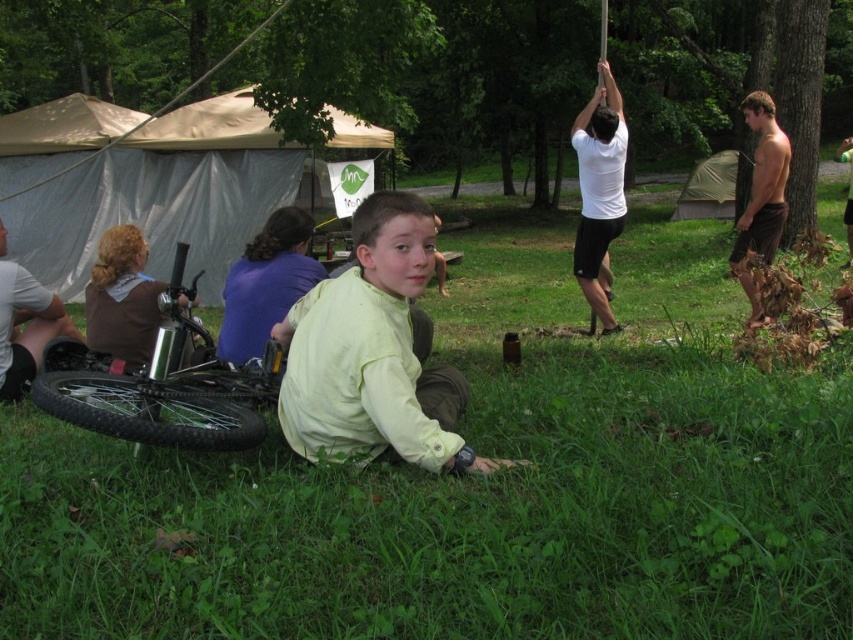
Question: Does green grass at lower center lie in front of silver metallic bicycle at lower left?

Choices:
 (A) no
 (B) yes

Answer: (B)

Question: Which of the following is the closest to the observer?

Choices:
 (A) brown textured shorts at right
 (B) light green fabric shirt at center
 (C) brushed metal water bottle at left

Answer: (B)

Question: Which point appears closest to the camera in this image?

Choices:
 (A) (57, 404)
 (B) (509, 310)

Answer: (A)

Question: Does green grass at lower center appear under white matte shirt at upper right?

Choices:
 (A) no
 (B) yes

Answer: (B)

Question: Which of these objects is positioned closest to the black rubber tire at lower left?

Choices:
 (A) beige tarpaulin tent at upper left
 (B) white matte shirt at upper right

Answer: (B)

Question: Can you confirm if silver metallic bicycle at lower left is smaller than brushed metal water bottle at left?

Choices:
 (A) yes
 (B) no

Answer: (B)